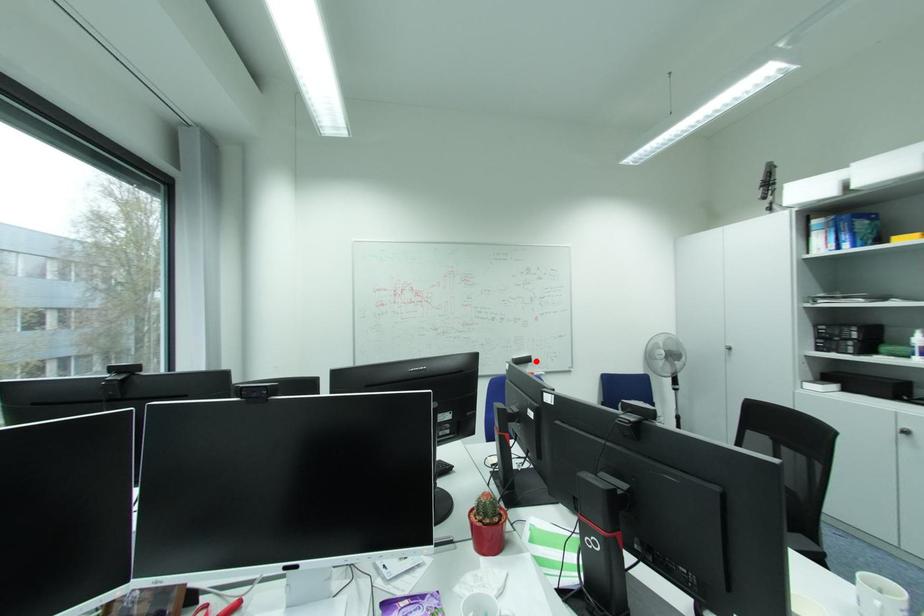
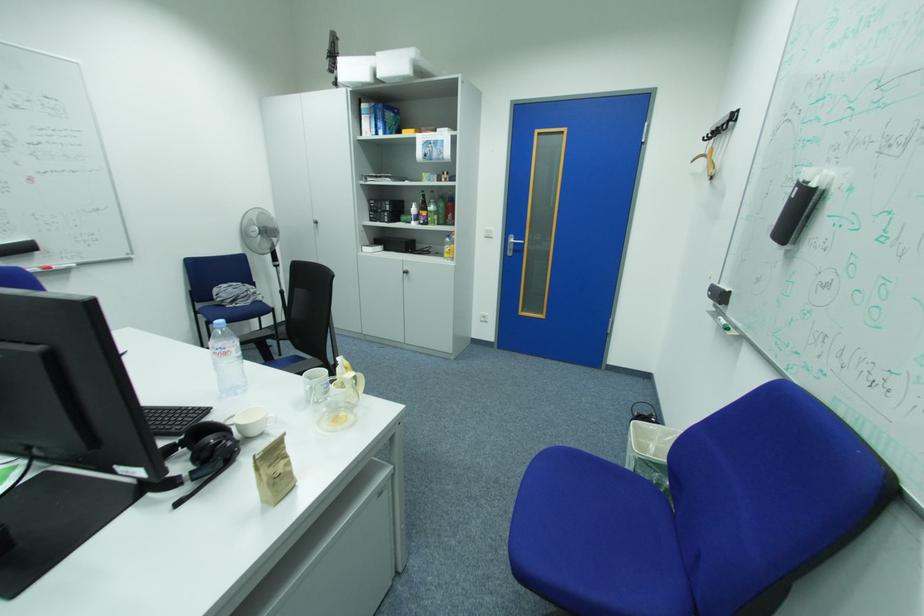
Where in the second image is the point corresponding to the highlighted location from the first image?

(33, 249)